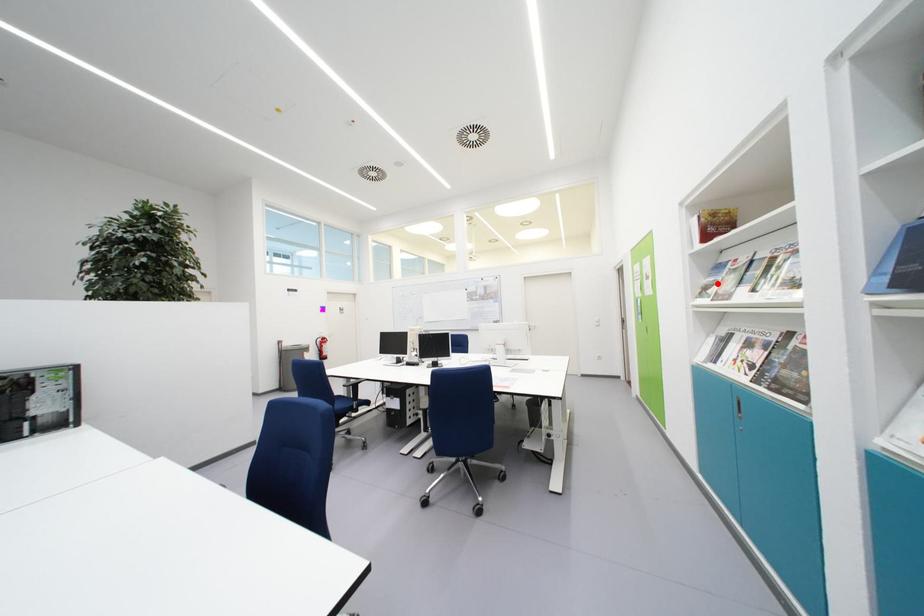
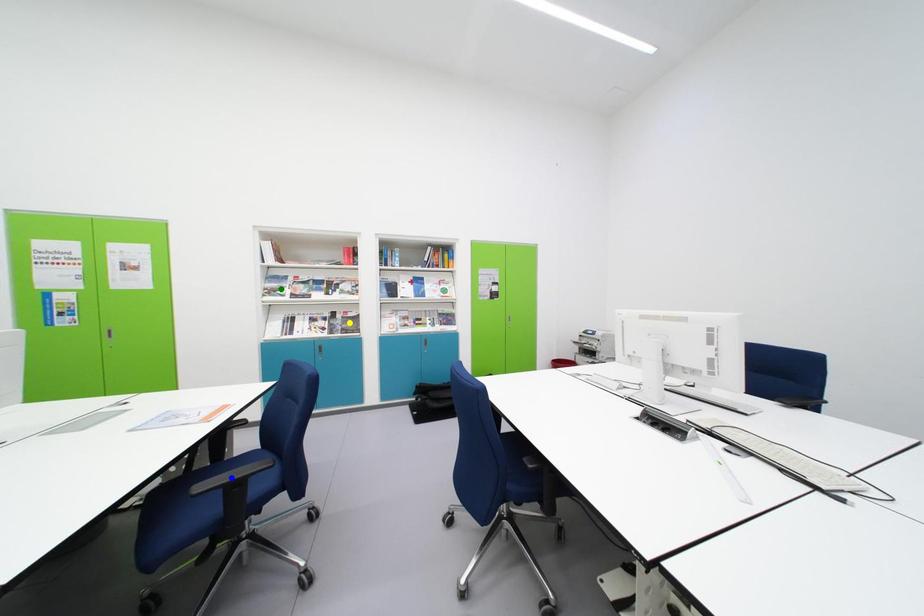
Question: I am providing you with two images of the same scene from different viewpoints. A red point is marked on the first image. You are given multiple points on the second image. Which point in image 2 is actually the same real-world point as the red point in image 1?

Choices:
 (A) yellow point
 (B) blue point
 (C) green point

Answer: (C)